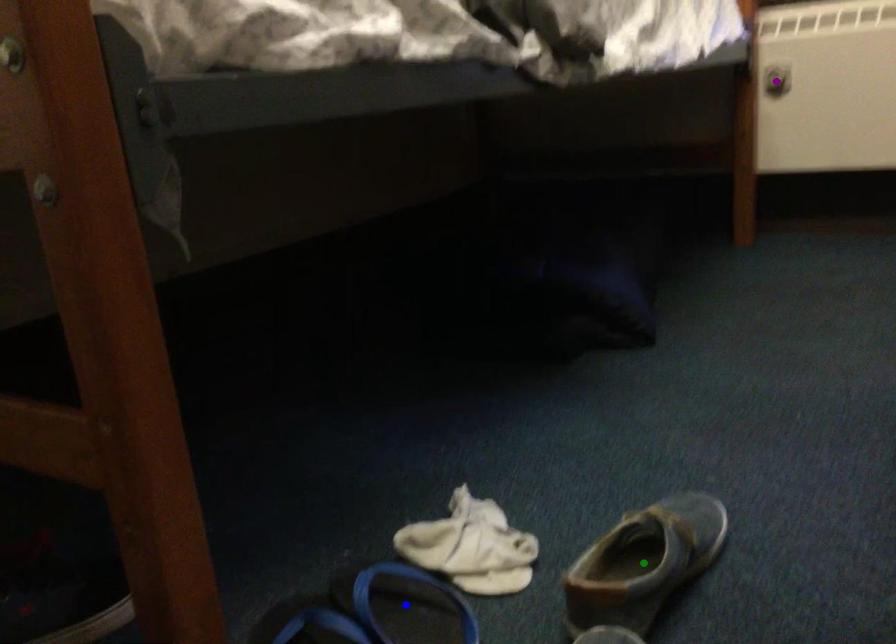
Order these from nearest to farthest:
A) blue point
B) green point
C) purple point

blue point
green point
purple point